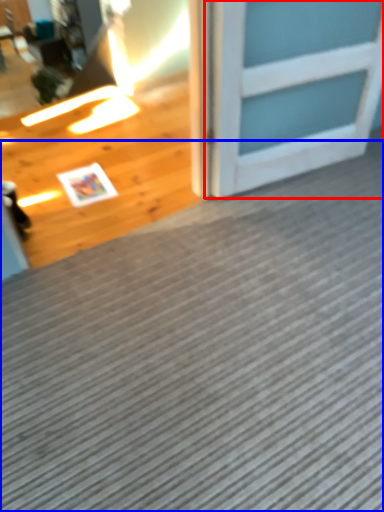
Question: Among these objects, which one is nearest to the camera, door (highlighted by a red box) or doormat (highlighted by a blue box)?

Choices:
 (A) door
 (B) doormat

Answer: (B)